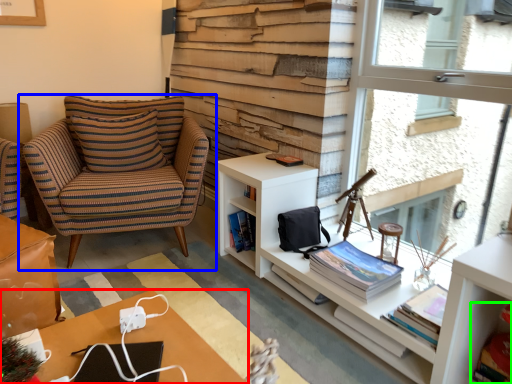
Question: Estimate the real-world distances between objects in this image. Which object is farther from desk (highlighted by a red box), chair (highlighted by a blue box) or book (highlighted by a green box)?

Choices:
 (A) chair
 (B) book

Answer: (A)